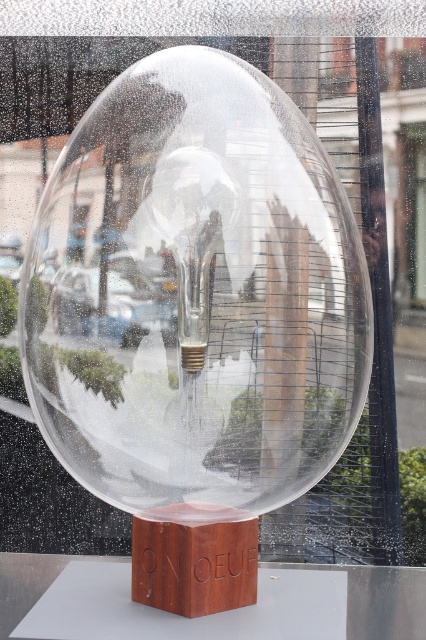
You are an interior designer planning to place a small decorative item on a shelf. The shelf has a width of 15 cm. You have two options from the image, the transparent glass bubble at center and the wooden cube at center. Which object can fit on the shelf based on their widths?

The transparent glass bubble at center has a larger width than the wooden cube at center. Since the shelf is 15 cm wide, only the wooden cube at center can fit as it is narrower than the shelf.

You are standing in front of an art installation and see the transparent glass bubble at center and the wooden cube at center. Which object is closer to you?

The transparent glass bubble at center is closer to you because it is in front of the wooden cube at center.